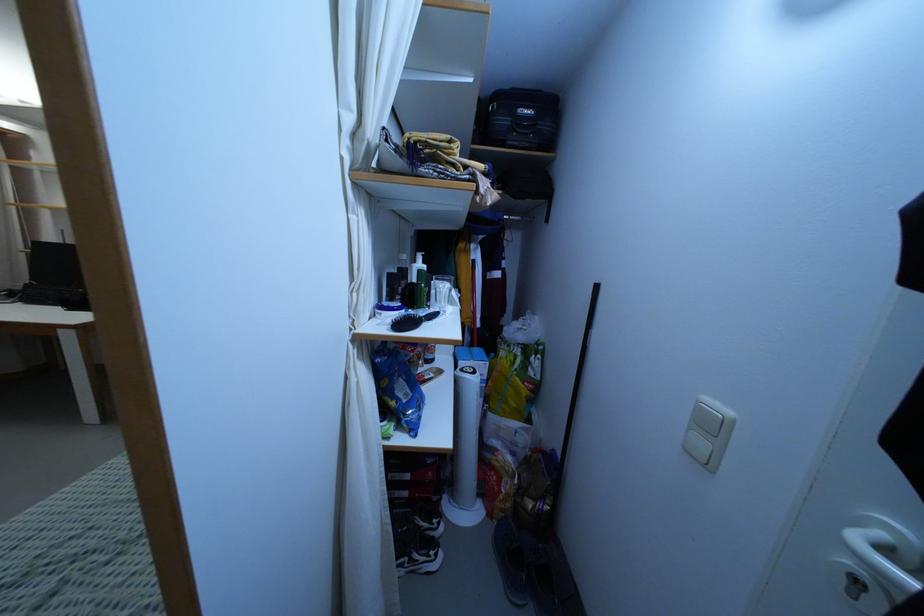
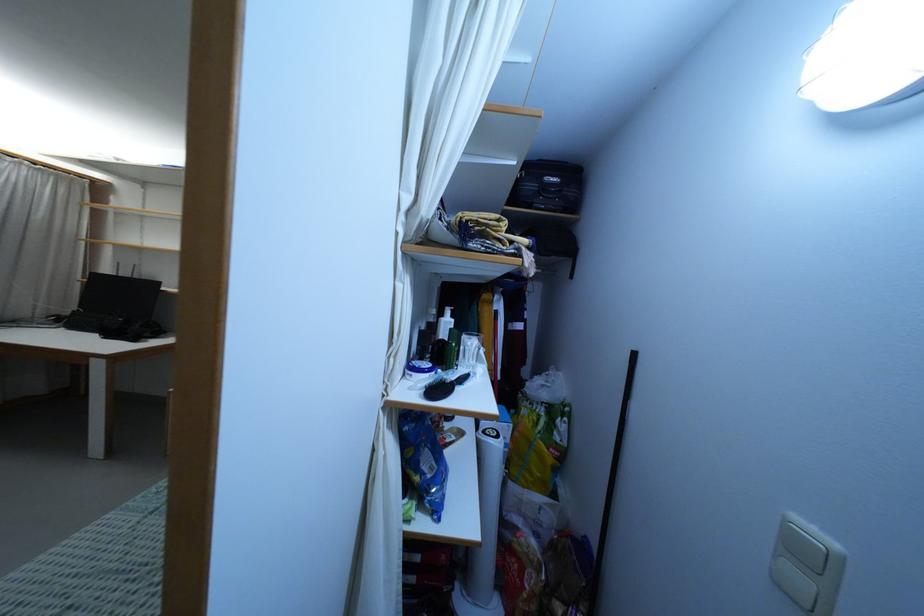
Question: How did the camera likely rotate?

Choices:
 (A) Left
 (B) Right
 (C) Up
 (D) Down

Answer: (C)